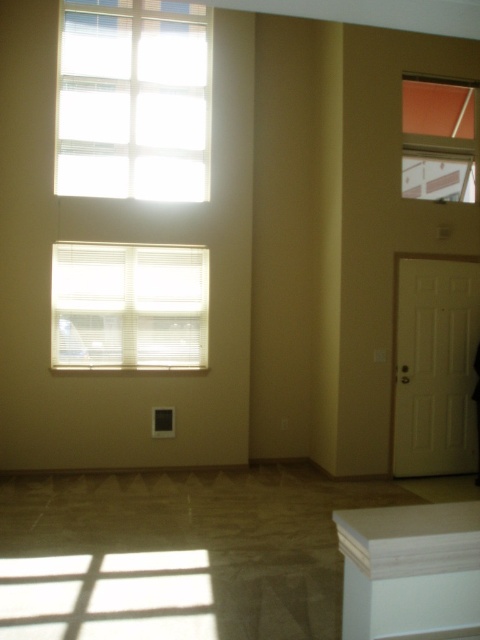
Question: Can you confirm if white matte blinds at upper left is positioned below white wood cabinet at lower right?

Choices:
 (A) no
 (B) yes

Answer: (A)

Question: Among these objects, which one is nearest to the camera?

Choices:
 (A) white wood cabinet at lower right
 (B) white textured blinds at upper left

Answer: (A)

Question: Which is nearer to the white textured blinds at upper left?

Choices:
 (A) matte glass window at upper right
 (B) white matte blinds at upper left

Answer: (B)

Question: Does white textured blinds at upper left have a smaller size compared to white matte blinds at upper left?

Choices:
 (A) yes
 (B) no

Answer: (B)

Question: Does white wood cabinet at lower right appear over matte glass window at upper right?

Choices:
 (A) no
 (B) yes

Answer: (A)

Question: Which of the following is the closest to the observer?

Choices:
 (A) (79, 12)
 (B) (119, 272)
 (C) (386, 573)

Answer: (C)